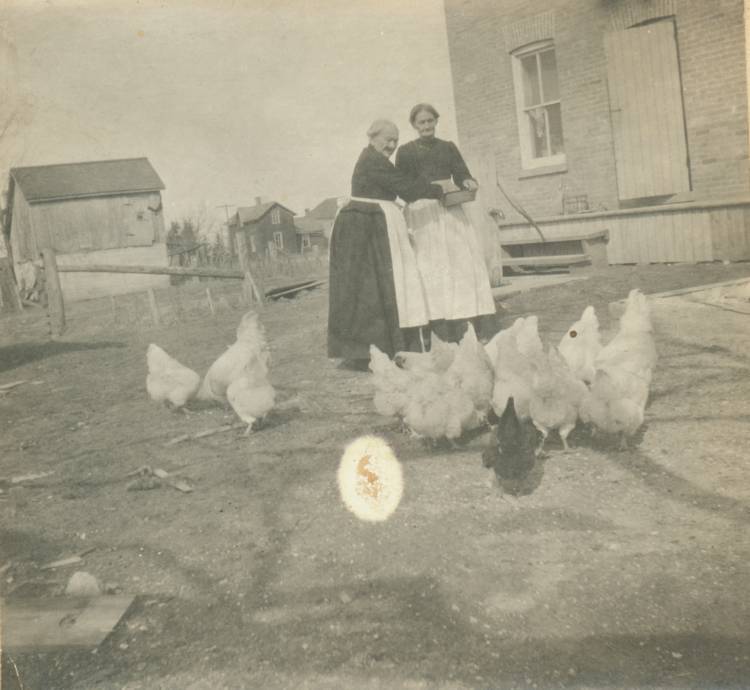
Where is `door`? Image resolution: width=750 pixels, height=690 pixels. door is located at coordinates (628, 112).